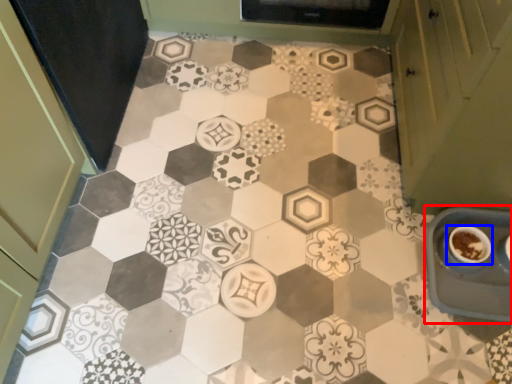
Question: Which point is closer to the camera, sink (highlighted by a red box) or coffee cup (highlighted by a blue box)?

Choices:
 (A) sink
 (B) coffee cup

Answer: (A)